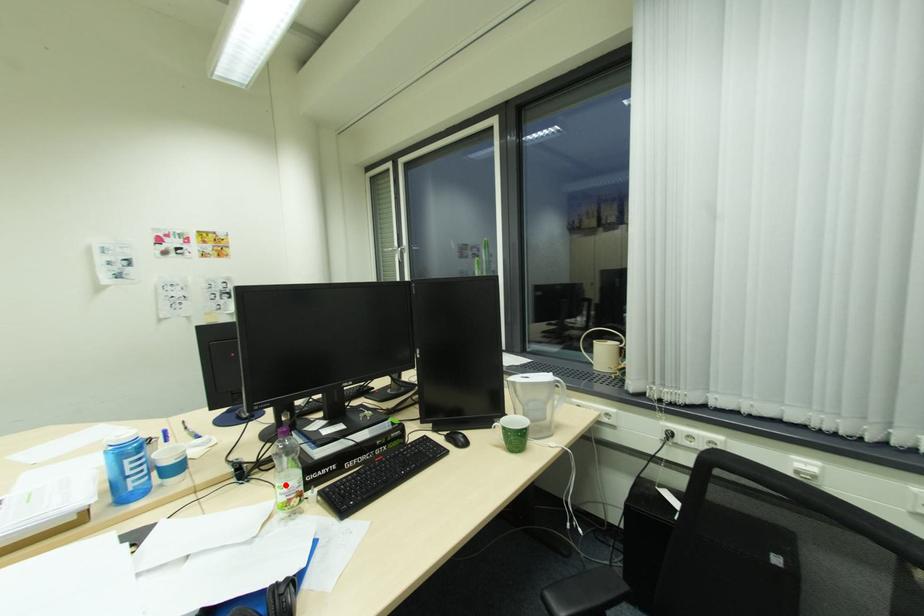
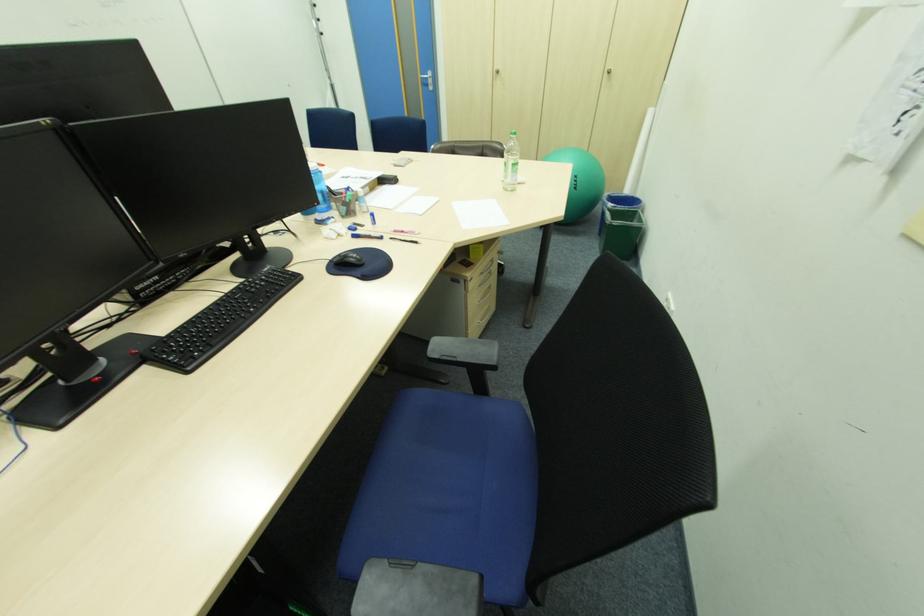
Question: I am providing you with two images of the same scene from different viewpoints. A red point is marked on the first image. At the location where the point appears in image 1, is it still visible in image 2?

Choices:
 (A) Yes
 (B) No

Answer: (B)